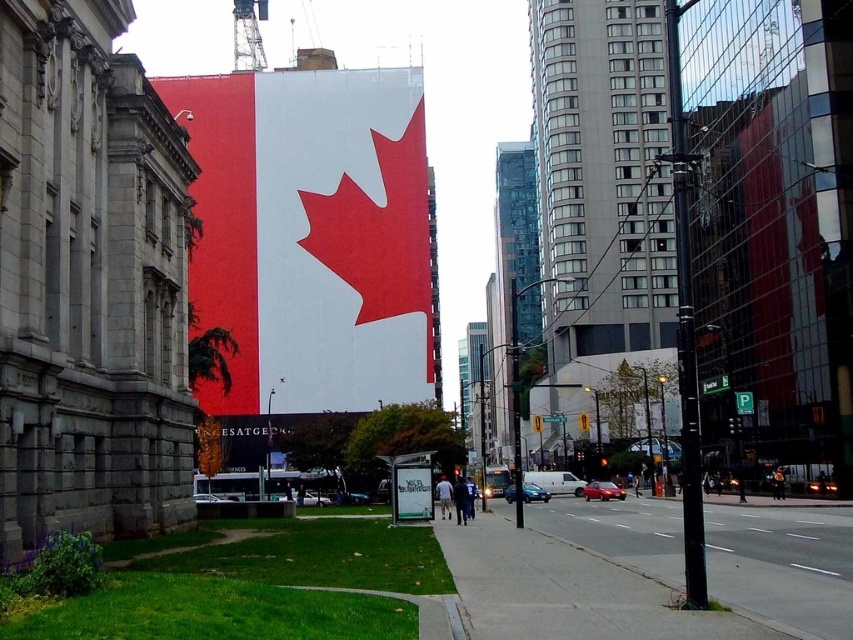
You are standing on the sidewalk in front of the building with the matte red and white flag at center. You want to take a photo of the flag without any obstructions. Considering your camera has a maximum zoom range of 100 meters, will you be able to capture the flag clearly without moving closer?

The matte red and white flag at center is 128.34 meters away from the viewer. Since your camera can only zoom up to 100 meters, you will not be able to capture the flag clearly without moving closer.

You are standing on the sidewalk and looking at the street scene. There are two points marked on the image, point 1 at coordinates point [231,131] and point 2 at coordinates point [764,556]. Which point is closer to you?

Point [231,131] is further to the camera than point [764,556], so point [764,556] is closer to you.

You are a tourist standing on the sidewalk and want to take a photo of both the matte red and white flag at center and the white matte sign at center. Which object should you frame first in your camera viewfinder to ensure both are captured in the same shot?

You should frame the matte red and white flag at center first since it is positioned to the left of the white matte sign at center, ensuring both are included in the photo.